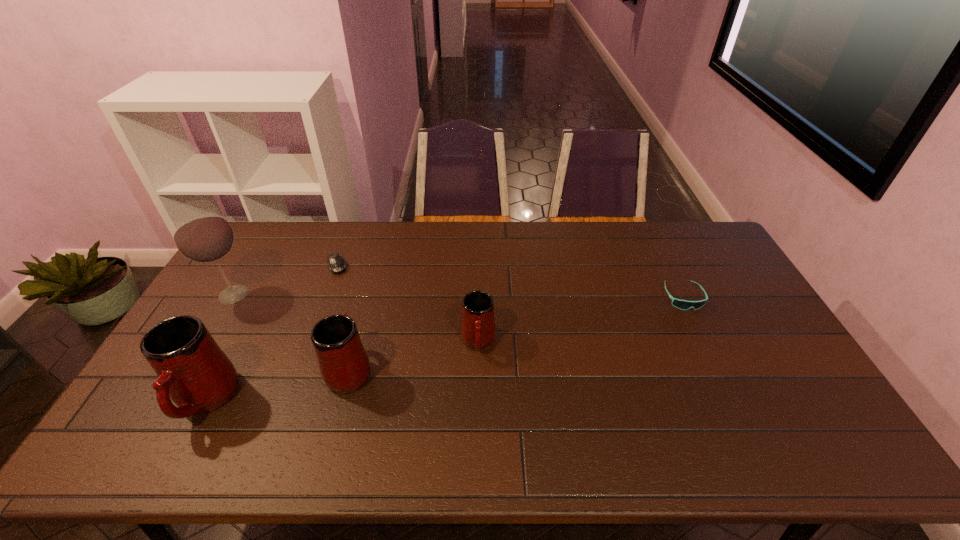
This screenshot has height=540, width=960. In order to click on vacant space in between the alcohol and the second mug from left to right in this screenshot , I will do `click(292, 332)`.

At what (x,y) coordinates should I click in order to perform the action: click on vacant space in between the rightmost object and the third tallest object. Please return your answer as a coordinate pair (x, y). Looking at the image, I should click on coord(516,333).

Locate an element on the screen. This screenshot has height=540, width=960. vacant area that lies between the tallest mug and the rightmost object is located at coordinates (444, 348).

The image size is (960, 540). I want to click on free spot between the rightmost object and the third shortest object, so click(x=581, y=320).

I want to click on free space between the second tallest mug and the rightmost object, so click(x=516, y=333).

Identify which object is the second nearest to the sunglasses. Please provide its 2D coordinates. Your answer should be formatted as a tuple, i.e. [(x, y)], where the tuple contains the x and y coordinates of a point satisfying the conditions above.

[(344, 366)]

Locate which object ranks third in proximity to the alcohol. Please provide its 2D coordinates. Your answer should be formatted as a tuple, i.e. [(x, y)], where the tuple contains the x and y coordinates of a point satisfying the conditions above.

[(344, 366)]

Point out which mug is positioned as the third nearest to the farthest object. Please provide its 2D coordinates. Your answer should be formatted as a tuple, i.e. [(x, y)], where the tuple contains the x and y coordinates of a point satisfying the conditions above.

[(478, 330)]

Identify the location of mug that is the second nearest to the tallest mug. The image size is (960, 540). (478, 330).

Image resolution: width=960 pixels, height=540 pixels. Identify the location of vacant position in the image that satisfies the following two spatial constraints: 1. on the back side of the tallest object; 2. on the right side of the fourth object from right to left. (251, 266).